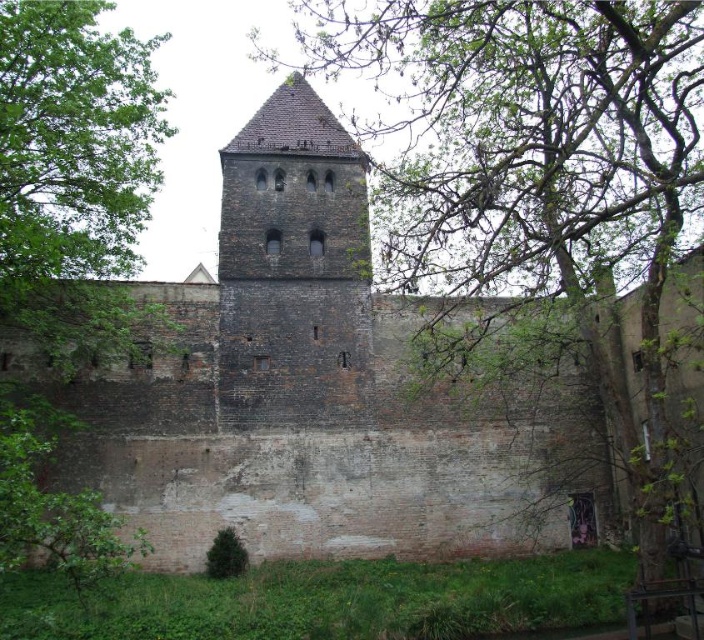
Question: Among these objects, which one is nearest to the camera?

Choices:
 (A) green leafy tree at upper center
 (B) dark brown stone tower at center
 (C) green leafy tree at lower left

Answer: (C)

Question: Which point is closer to the camera?

Choices:
 (A) (87, 547)
 (B) (440, 60)
 (C) (325, 330)
 (D) (37, 237)

Answer: (A)

Question: Which object is the closest to the green leafy tree at upper center?

Choices:
 (A) dark brown stone tower at center
 (B) green leafy tree at left
 (C) green leafy tree at lower left

Answer: (A)

Question: Is green leafy tree at left to the right of dark brown stone tower at center from the viewer's perspective?

Choices:
 (A) yes
 (B) no

Answer: (B)

Question: Is green leafy tree at upper center smaller than dark brown stone tower at center?

Choices:
 (A) yes
 (B) no

Answer: (B)

Question: Considering the relative positions of green leafy tree at left and dark brown stone tower at center in the image provided, where is green leafy tree at left located with respect to dark brown stone tower at center?

Choices:
 (A) below
 (B) above

Answer: (B)